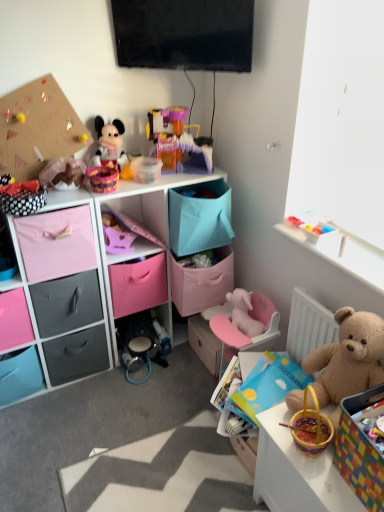
Question: Is point (210, 164) positioned closer to the camera than point (33, 392)?

Choices:
 (A) closer
 (B) farther

Answer: (B)

Question: Do you think translucent plastic playset at upper center, which is the 1th toy in top-to-bottom order, is within pink fabric drawer at lower left, marked as the first drawer in a left-to-right arrangement, or outside of it?

Choices:
 (A) outside
 (B) inside

Answer: (A)

Question: Which of these objects is positioned closest to the pink fabric drawer at lower left, the second drawer viewed from the left?

Choices:
 (A) matte black drawer at left, the 5th drawer in the right-to-left sequence
 (B) fuzzy brown teddy bear at upper left, arranged as the first toy when viewed from the left
 (C) pink fabric storage unit at center
 (D) translucent plastic playset at upper center, arranged as the third toy when viewed from the left
 (E) pink fabric drawer at left, the third drawer viewed from the right

Answer: (A)

Question: Based on their relative distances, which object is farther from the multicolored woven basket at lower right?

Choices:
 (A) pink plush elephant at center, which appears as the 1th toy when ordered from the bottom
 (B) translucent plastic playset at upper center, positioned as the fourth toy in bottom-to-top order
 (C) plush mickey mouse at upper left, placed as the 2th toy when sorted from top to bottom
 (D) pink fabric drawer at center, the first drawer in the right-to-left sequence
 (E) matte black drawer at lower left, placed as the 4th drawer when sorted from right to left

Answer: (C)